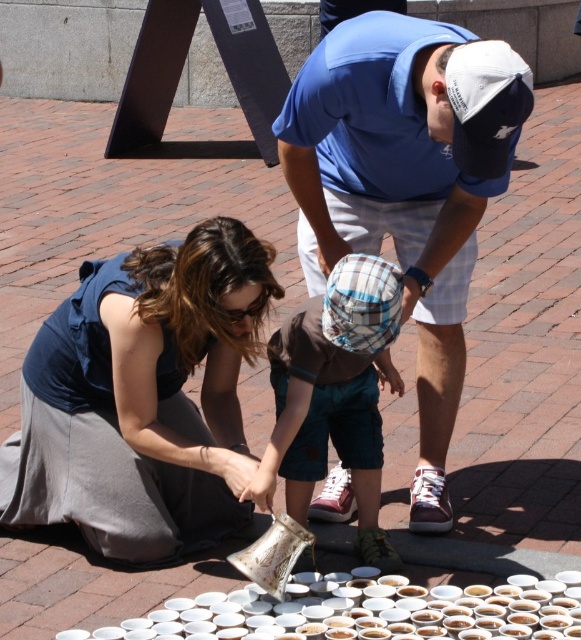
Question: Which point is farther from the camera taking this photo?

Choices:
 (A) (235, 442)
 (B) (342, 28)

Answer: (A)

Question: Does blue fabric dress at lower left appear over blue cotton shirt at center?

Choices:
 (A) no
 (B) yes

Answer: (A)

Question: Which point is farther from the camera taking this photo?

Choices:
 (A) (342, 369)
 (B) (67, 364)

Answer: (B)

Question: Which object appears farthest from the camera in this image?

Choices:
 (A) white matte cup at center
 (B) blue cotton shirt at center

Answer: (A)

Question: Where is blue cotton shirt at center located in relation to brown cotton shirt at center in the image?

Choices:
 (A) above
 (B) below

Answer: (A)

Question: Can you confirm if brown cotton shirt at center is positioned above white matte cup at center?

Choices:
 (A) yes
 (B) no

Answer: (A)